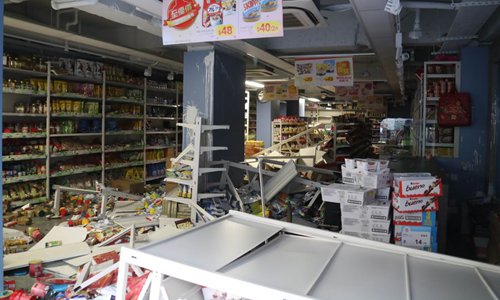
You are a GUI agent. You are given a task and a screenshot of the screen. Output one action in this format:
    pyautogui.click(x=<x>, y=<y>)
    Task: Click on the white package on shelf
    This screenshot has height=300, width=500.
    Given the screenshot: What is the action you would take?
    pyautogui.click(x=86, y=69)